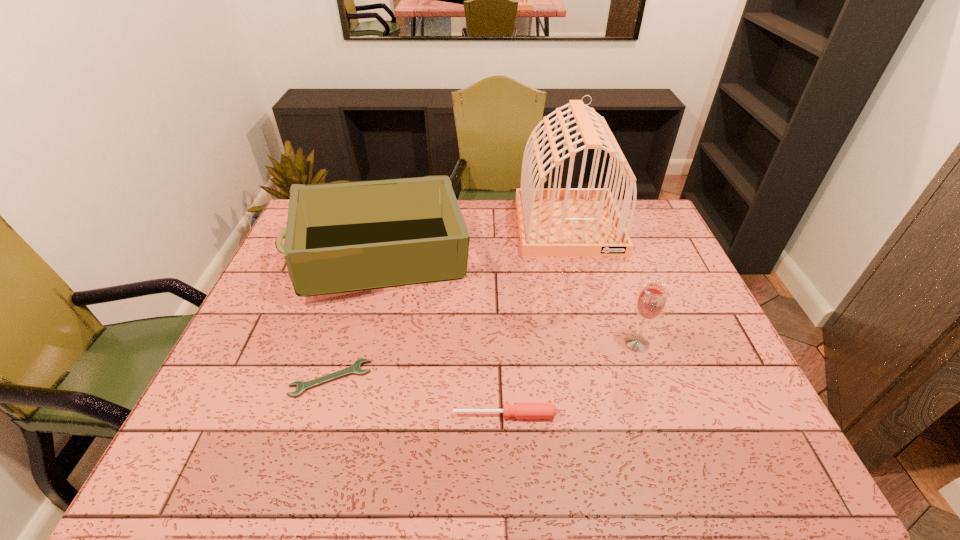
The image size is (960, 540). Find the location of `free location located 0.100m on the front of the nearest object`. free location located 0.100m on the front of the nearest object is located at coordinates (507, 465).

This screenshot has width=960, height=540. What are the coordinates of `vacant space located on the back of the wrench` in the screenshot? It's located at (360, 280).

Identify the location of birdcage that is at the far edge. The width and height of the screenshot is (960, 540). (553, 222).

At what (x,y) coordinates should I click in order to perform the action: click on box that is positioned at the far edge. Please return your answer as a coordinate pair (x, y). This screenshot has height=540, width=960. Looking at the image, I should click on (344, 236).

The height and width of the screenshot is (540, 960). Find the location of `object situated at the left edge`. object situated at the left edge is located at coordinates (344, 236).

The width and height of the screenshot is (960, 540). What are the coordinates of `object present at the right edge` in the screenshot? It's located at (553, 222).

Where is `object at the far left corner`? object at the far left corner is located at coordinates tap(344, 236).

You are a GUI agent. You are given a task and a screenshot of the screen. Output one action in this format:
    pyautogui.click(x=<x>, y=<y>)
    Task: Click on the object located in the far right corner section of the desktop
    
    Given the screenshot: What is the action you would take?
    pyautogui.click(x=553, y=222)

This screenshot has width=960, height=540. In order to click on vacant space at the far edge of the desktop in this screenshot , I will do `click(485, 199)`.

The width and height of the screenshot is (960, 540). In the image, there is a desktop. What are the coordinates of `free region at the near edge` in the screenshot? It's located at (597, 457).